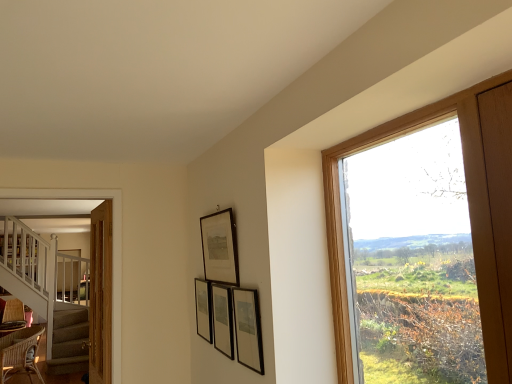
Question: Is wooden frame at right far from matte black picture frame at center, the first picture frame when ordered from front to back?

Choices:
 (A) yes
 (B) no

Answer: (B)

Question: Is wooden frame at right in front of matte black picture frame at center, the first picture frame when ordered from front to back?

Choices:
 (A) yes
 (B) no

Answer: (A)

Question: Can matte black picture frame at center, the first picture frame when ordered from front to back, be found inside wooden frame at right?

Choices:
 (A) no
 (B) yes

Answer: (A)

Question: Does wooden frame at right have a greater width compared to matte black picture frame at center, the first picture frame when ordered from front to back?

Choices:
 (A) yes
 (B) no

Answer: (A)

Question: Is wooden frame at right positioned behind matte black picture frame at center, which ranks as the 4th picture frame in back-to-front order?

Choices:
 (A) no
 (B) yes

Answer: (A)

Question: Considering the positions of point (250, 369) and point (204, 228), is point (250, 369) closer or farther from the camera than point (204, 228)?

Choices:
 (A) closer
 (B) farther

Answer: (A)

Question: Is matte black picture frame at center, which ranks as the 4th picture frame in back-to-front order, spatially inside matte black picture frame at upper center, which is the 2th picture frame from front to back, or outside of it?

Choices:
 (A) inside
 (B) outside

Answer: (B)

Question: In terms of width, does matte black picture frame at center, which ranks as the 4th picture frame in back-to-front order, look wider or thinner when compared to matte black picture frame at upper center, which is counted as the 3th picture frame, starting from the back?

Choices:
 (A) wide
 (B) thin

Answer: (B)

Question: Is matte black picture frame at center, which ranks as the 4th picture frame in back-to-front order, taller or shorter than matte black picture frame at upper center, which is counted as the 3th picture frame, starting from the back?

Choices:
 (A) short
 (B) tall

Answer: (A)

Question: Considering the positions of wooden frame at right and matte black picture frame at center, acting as the second picture frame starting from the back, in the image, is wooden frame at right wider or thinner than matte black picture frame at center, acting as the second picture frame starting from the back,?

Choices:
 (A) thin
 (B) wide

Answer: (B)

Question: Considering the positions of point (501, 235) and point (212, 306), is point (501, 235) closer or farther from the camera than point (212, 306)?

Choices:
 (A) farther
 (B) closer

Answer: (B)

Question: Considering the positions of wooden frame at right and matte black picture frame at center, the 3th picture frame positioned from the front, in the image, is wooden frame at right taller or shorter than matte black picture frame at center, the 3th picture frame positioned from the front,?

Choices:
 (A) tall
 (B) short

Answer: (A)

Question: From a real-world perspective, is wooden frame at right above or below matte black picture frame at center, the 3th picture frame positioned from the front?

Choices:
 (A) above
 (B) below

Answer: (A)

Question: In terms of width, does wooden frame at right look wider or thinner when compared to matte black picture frame at center, which is counted as the 1th picture frame, starting from the back?

Choices:
 (A) wide
 (B) thin

Answer: (A)

Question: Is point (351, 382) closer or farther from the camera than point (196, 314)?

Choices:
 (A) farther
 (B) closer

Answer: (B)